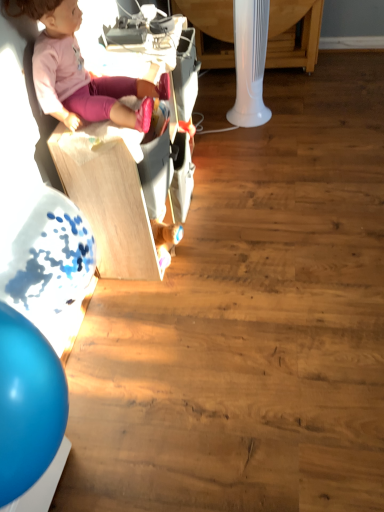
What are the coordinates of `space that is in front of white plastic table at upper center` in the screenshot? It's located at (297, 118).